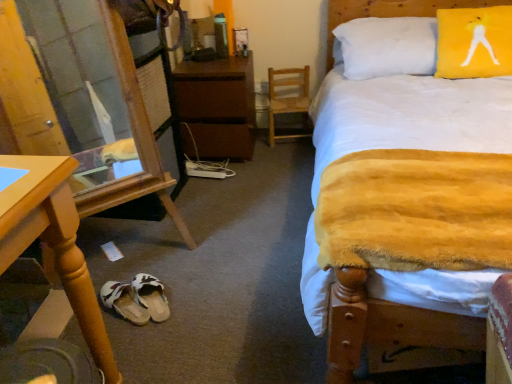
This screenshot has width=512, height=384. What are the coordinates of `empty space that is to the right of white fabric slipper at lower center, the 2th footwear in the left-to-right sequence` in the screenshot? It's located at (203, 295).